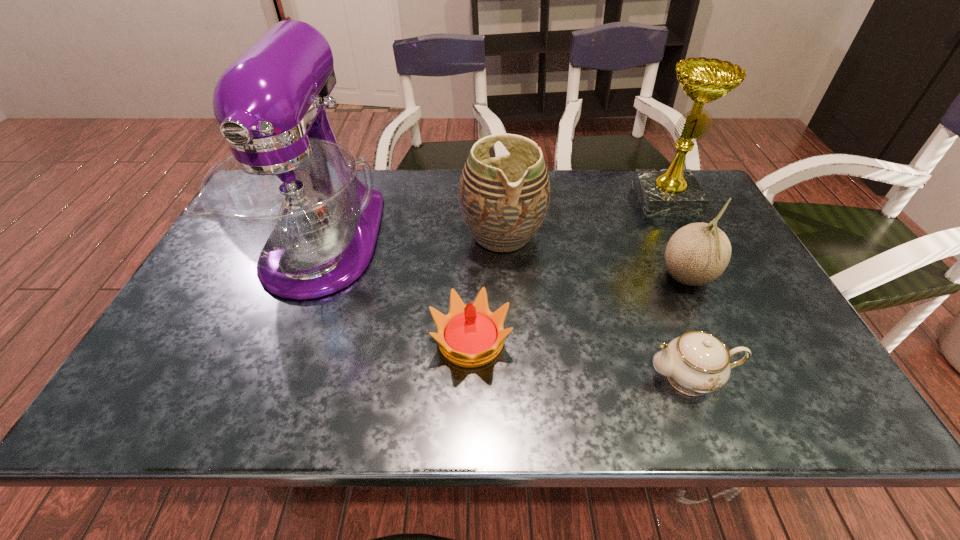
Where is `vacant point located on the left of the cantaloup`? The height and width of the screenshot is (540, 960). vacant point located on the left of the cantaloup is located at coordinates (586, 279).

The image size is (960, 540). What are the coordinates of `vacant region located on the front of the crown` in the screenshot? It's located at (469, 406).

Identify the location of vacant space situated at the spout of the chinaware. This screenshot has height=540, width=960. (468, 377).

You are a GUI agent. You are given a task and a screenshot of the screen. Output one action in this format:
    pyautogui.click(x=<x>, y=<y>)
    Task: Click on the vacant point located at the spout of the chinaware
    The image size is (960, 540).
    Given the screenshot: What is the action you would take?
    pyautogui.click(x=612, y=377)

I want to click on vacant space located 0.270m at the spout of the chinaware, so click(516, 377).

The image size is (960, 540). In order to click on mixer that is at the far edge in this screenshot , I will do `click(289, 198)`.

The width and height of the screenshot is (960, 540). Identify the location of award at the far edge. (675, 191).

This screenshot has width=960, height=540. In order to click on pottery present at the far edge in this screenshot , I will do `click(504, 200)`.

Where is `object located at the near edge`? The height and width of the screenshot is (540, 960). object located at the near edge is located at coordinates (695, 363).

Where is `object at the left edge`? object at the left edge is located at coordinates (289, 198).